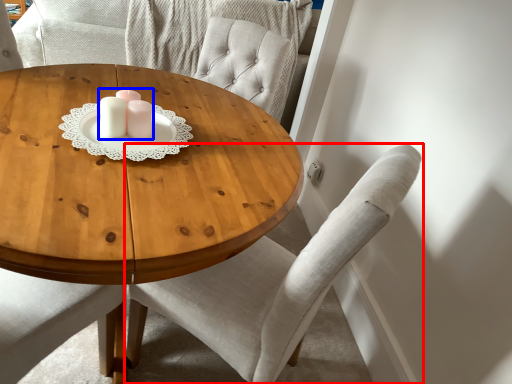
Question: Which of the following is the farthest to the observer, chair (highlighted by a red box) or candle holder (highlighted by a blue box)?

Choices:
 (A) chair
 (B) candle holder

Answer: (B)